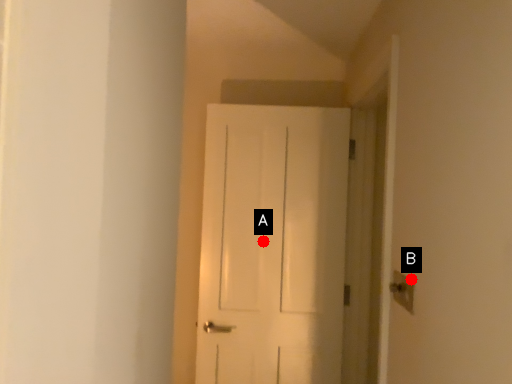
Question: Two points are circled on the image, labeled by A and B beside each circle. Which point appears farthest from the camera in this image?

Choices:
 (A) A is further
 (B) B is further

Answer: (A)